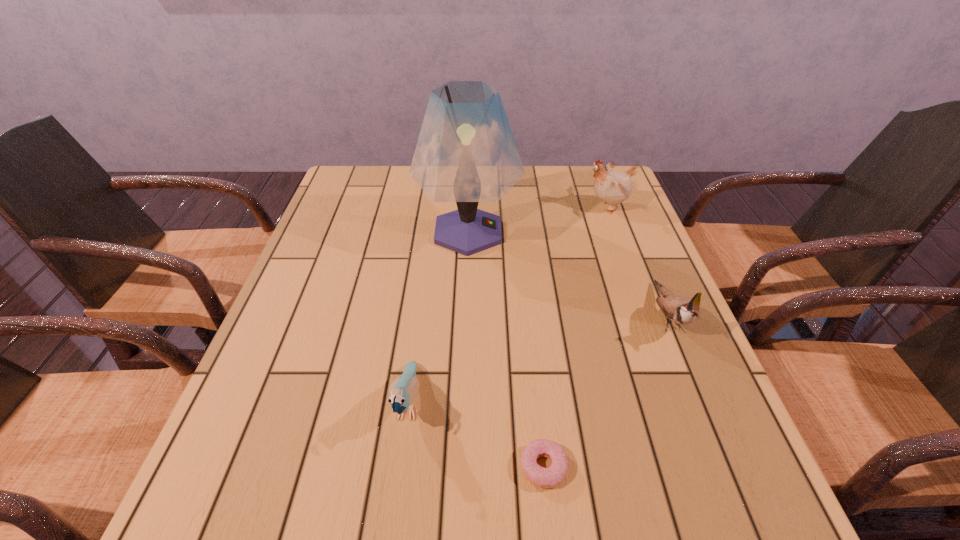
Identify the location of object that is the closest to the farthest bird. (466, 153).

The height and width of the screenshot is (540, 960). What are the coordinates of `object identified as the second closest to the tallest object` in the screenshot? It's located at (681, 310).

Identify which bird is the closest to the farthest bird. Please provide its 2D coordinates. Your answer should be formatted as a tuple, i.e. [(x, y)], where the tuple contains the x and y coordinates of a point satisfying the conditions above.

[(681, 310)]

Identify the location of bird that is the third closest one to the tallest object. The image size is (960, 540). (403, 390).

Locate an element on the screen. The image size is (960, 540). free space in the image that satisfies the following two spatial constraints: 1. on the base of the lampshade; 2. on the back side of the shortest object is located at coordinates (461, 467).

Where is `free space that satisfies the following two spatial constraints: 1. on the base of the shortest object; 2. on the left side of the tallest object`? The width and height of the screenshot is (960, 540). free space that satisfies the following two spatial constraints: 1. on the base of the shortest object; 2. on the left side of the tallest object is located at coordinates (461, 467).

Locate an element on the screen. Image resolution: width=960 pixels, height=540 pixels. vacant area that satisfies the following two spatial constraints: 1. at the face of the shortest object; 2. on the left side of the nearest bird is located at coordinates (400, 467).

Identify the location of free region that satisfies the following two spatial constraints: 1. on the base of the tallest object; 2. on the right side of the shortest object. (461, 467).

I want to click on free space in the image that satisfies the following two spatial constraints: 1. on the base of the doughnut; 2. on the left side of the lampshade, so click(x=461, y=467).

Image resolution: width=960 pixels, height=540 pixels. Identify the location of vacant space that satisfies the following two spatial constraints: 1. at the beak of the farthest bird; 2. at the face of the leftmost bird. (680, 403).